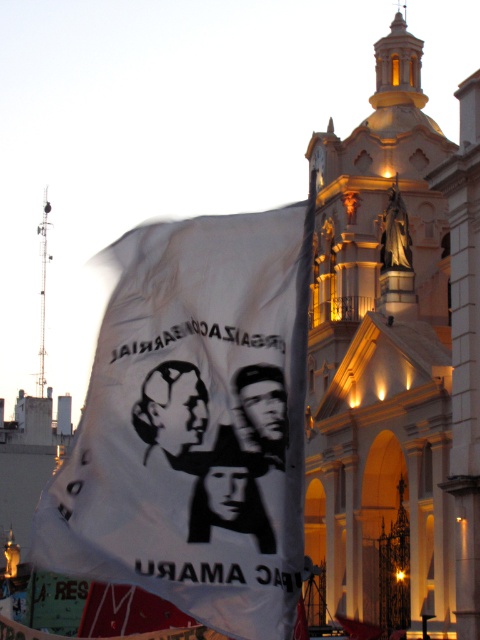
Consider the image. Is black matte portrait at center bigger than black glossy face at center?

Yes, black matte portrait at center is bigger than black glossy face at center.

Does black matte portrait at center have a smaller size compared to black glossy face at center?

Incorrect, black matte portrait at center is not smaller in size than black glossy face at center.

Who is more forward, (177, 401) or (282, 413)?

Point (177, 401) is in front.

The height and width of the screenshot is (640, 480). Find the location of `black matte portrait at center`. black matte portrait at center is located at coordinates (172, 412).

Does black matte face at center have a smaller size compared to black glossy face at center?

Actually, black matte face at center might be larger than black glossy face at center.

Does point (210, 497) come behind point (271, 381)?

No, (210, 497) is closer to viewer.

What do you see at coordinates (228, 490) in the screenshot?
I see `black matte face at center` at bounding box center [228, 490].

Where is `black matte face at center`? The height and width of the screenshot is (640, 480). black matte face at center is located at coordinates (228, 490).

Is white paper flag at center closer to camera compared to black matte portrait at center?

Yes, white paper flag at center is closer to the viewer.

Who is more distant from viewer, (219,337) or (156,397)?

The point (219,337) is more distant.

This screenshot has width=480, height=640. In order to click on white paper flag at center in this screenshot , I will do `click(192, 424)`.